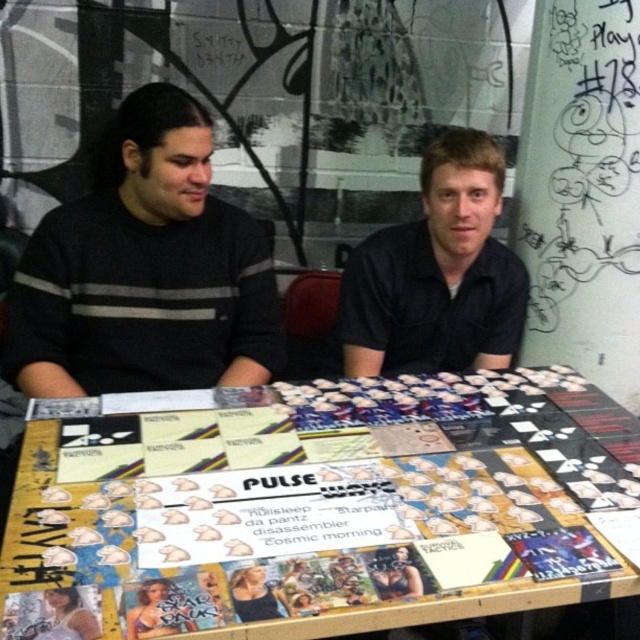
Can you confirm if black striped sweater at left is positioned to the right of black matte shirt at center?

In fact, black striped sweater at left is to the left of black matte shirt at center.

Between black striped sweater at left and black matte shirt at center, which one has less height?

black matte shirt at center is shorter.

Is point (54, 323) more distant than point (412, 358)?

No, it is not.

Find the location of a particular element. black striped sweater at left is located at coordinates (145, 269).

Based on the photo, does wooden board game at center appear under black striped sweater at left?

Yes, wooden board game at center is below black striped sweater at left.

Who is lower down, wooden board game at center or black striped sweater at left?

wooden board game at center is lower down.

In the scene shown: Who is more distant from viewer, (244, 634) or (252, 266)?

The point (252, 266) is more distant.

The width and height of the screenshot is (640, 640). Identify the location of wooden board game at center. (317, 513).

Consider the image. Is wooden board game at center thinner than black matte shirt at center?

In fact, wooden board game at center might be wider than black matte shirt at center.

Find the location of a particular element. wooden board game at center is located at coordinates (317, 513).

Who is more distant from viewer, (595,412) or (440,161)?

The point (440,161) is behind.

Find the location of a particular element. The width and height of the screenshot is (640, 640). wooden board game at center is located at coordinates (317, 513).